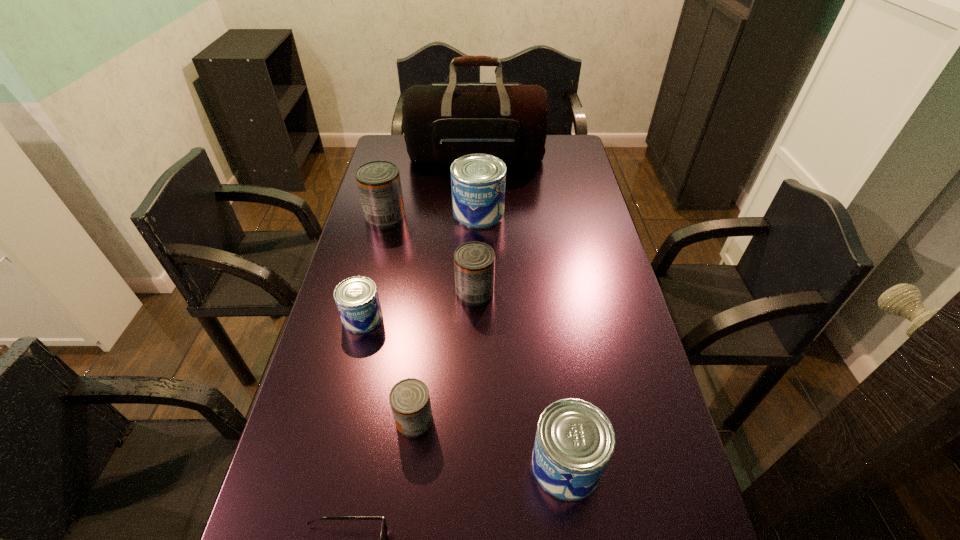
Where is `red duffel bag`? The width and height of the screenshot is (960, 540). red duffel bag is located at coordinates (442, 122).

You are a GUI agent. You are given a task and a screenshot of the screen. Output one action in this format:
    pyautogui.click(x=<x>, y=<y>)
    Task: Click on the farthest object
    Image resolution: width=960 pixels, height=540 pixels.
    Given the screenshot: What is the action you would take?
    pyautogui.click(x=442, y=122)

Locate an element on the screen. Image resolution: width=960 pixels, height=540 pixels. the biggest red can is located at coordinates (379, 186).

Identify the location of the farthest red can. This screenshot has width=960, height=540. (379, 186).

You are a GUI agent. You are given a task and a screenshot of the screen. Output one action in this format:
    pyautogui.click(x=<x>, y=<y>)
    Task: Click on the second blue can from left to right
    The width and height of the screenshot is (960, 540).
    Given the screenshot: What is the action you would take?
    pyautogui.click(x=478, y=181)

Locate an element on the screen. the biggest blue can is located at coordinates (478, 181).

Locate an element on the screen. This screenshot has height=540, width=960. the second biggest red can is located at coordinates (x=474, y=262).

In order to click on the rightmost red can in this screenshot , I will do `click(474, 262)`.

Where is `the rightmost blue can`? The image size is (960, 540). the rightmost blue can is located at coordinates (574, 442).

You are a GUI agent. You are given a task and a screenshot of the screen. Output one action in this format:
    pyautogui.click(x=<x>, y=<y>)
    Task: Click on the rightmost can
    
    Given the screenshot: What is the action you would take?
    pyautogui.click(x=574, y=442)